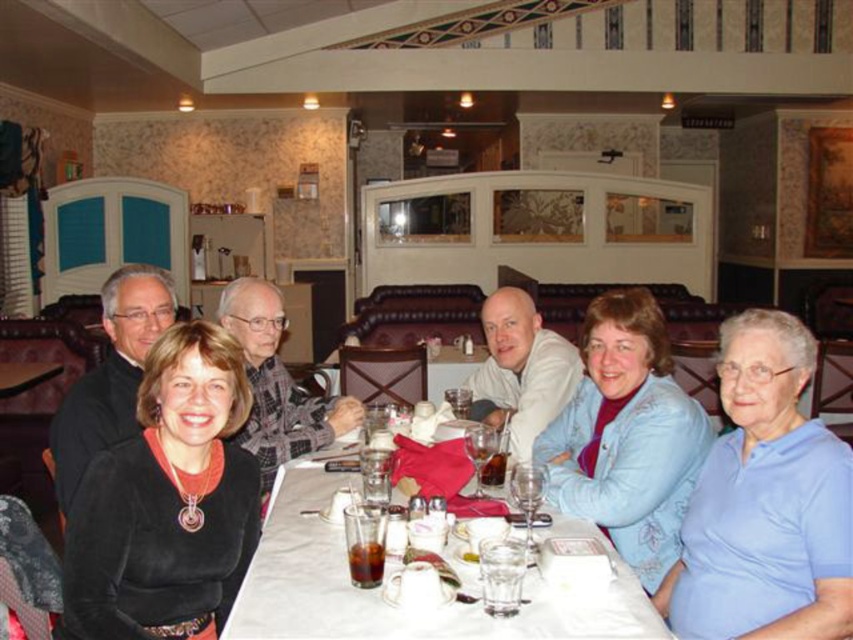
Question: Is the position of black fuzzy sweater at lower left less distant than that of light blue cotton shirt at lower right?

Choices:
 (A) yes
 (B) no

Answer: (A)

Question: Is plaid fabric shirt at center thinner than white matte shirt at center?

Choices:
 (A) yes
 (B) no

Answer: (B)

Question: Does blue satin jacket at center come in front of white matte shirt at center?

Choices:
 (A) no
 (B) yes

Answer: (B)

Question: Which object appears farthest from the camera in this image?

Choices:
 (A) white glossy table at center
 (B) white matte shirt at center

Answer: (B)

Question: Which object is positioned closest to the white matte shirt at center?

Choices:
 (A) light blue cotton shirt at lower right
 (B) plaid fabric shirt at center

Answer: (B)

Question: Which point is farther to the camera?

Choices:
 (A) (602, 321)
 (B) (346, 593)

Answer: (A)